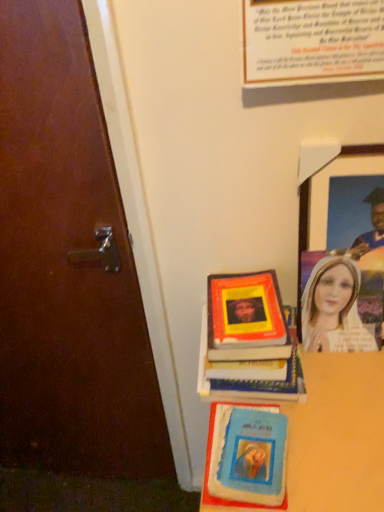
Locate an element on the screen. free space in front of hardcover book at center is located at coordinates 329,445.